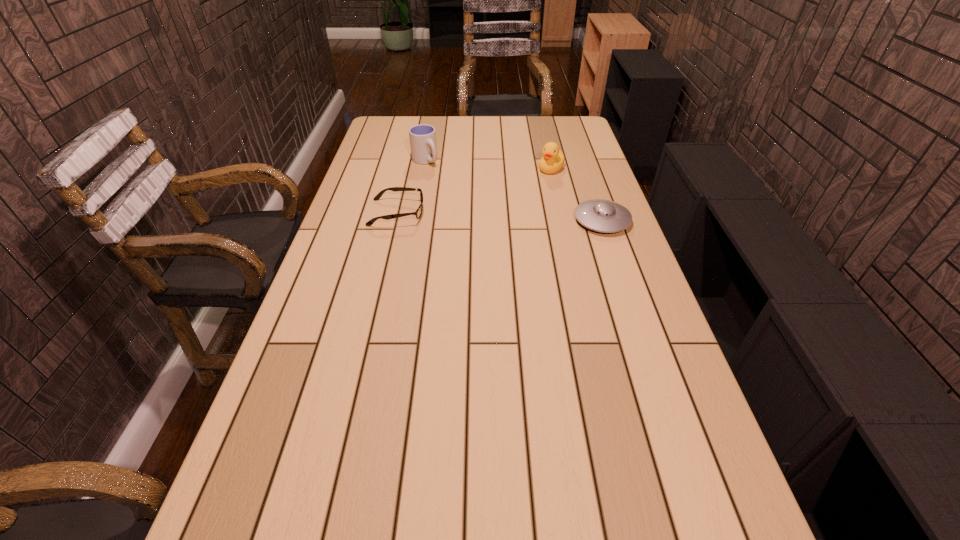
At what (x,y) coordinates should I click in order to perform the action: click on free spot on the desktop that is between the spectacles and the saucer and is positioned with the handle on the side of the cup. Please return your answer as a coordinate pair (x, y). This screenshot has height=540, width=960. Looking at the image, I should click on (477, 215).

Locate an element on the screen. The width and height of the screenshot is (960, 540). vacant space on the desktop that is between the spectacles and the third tallest object and is positioned on the face of the duckling is located at coordinates (492, 216).